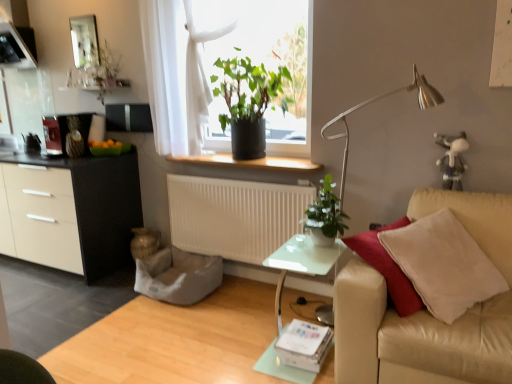
Question: In which direction should I rotate to look at green matte plant at upper center, the 1th houseplant positioned from the back?

Choices:
 (A) right
 (B) left

Answer: (B)

Question: Is green leafy plant at center wider than silver metallic floor lamp at right?

Choices:
 (A) no
 (B) yes

Answer: (A)

Question: Considering the relative sizes of green leafy plant at center and silver metallic floor lamp at right in the image provided, is green leafy plant at center bigger than silver metallic floor lamp at right?

Choices:
 (A) no
 (B) yes

Answer: (B)

Question: From a real-world perspective, is green leafy plant at center over silver metallic floor lamp at right?

Choices:
 (A) yes
 (B) no

Answer: (A)

Question: Could silver metallic floor lamp at right be considered to be inside green leafy plant at center?

Choices:
 (A) yes
 (B) no

Answer: (B)

Question: Considering the relative positions of green leafy plant at center and silver metallic floor lamp at right in the image provided, is green leafy plant at center behind silver metallic floor lamp at right?

Choices:
 (A) yes
 (B) no

Answer: (A)

Question: Considering the relative sizes of green leafy plant at center and silver metallic floor lamp at right in the image provided, is green leafy plant at center thinner than silver metallic floor lamp at right?

Choices:
 (A) no
 (B) yes

Answer: (B)

Question: Are smooth beige couch at right and transparent glass door at left located far from each other?

Choices:
 (A) no
 (B) yes

Answer: (B)

Question: Considering the relative sizes of smooth beige couch at right and transparent glass door at left in the image provided, is smooth beige couch at right smaller than transparent glass door at left?

Choices:
 (A) yes
 (B) no

Answer: (B)

Question: From a real-world perspective, is smooth beige couch at right positioned under transparent glass door at left based on gravity?

Choices:
 (A) yes
 (B) no

Answer: (A)

Question: Is smooth beige couch at right positioned before transparent glass door at left?

Choices:
 (A) no
 (B) yes

Answer: (B)

Question: Considering the relative sizes of smooth beige couch at right and transparent glass door at left in the image provided, is smooth beige couch at right thinner than transparent glass door at left?

Choices:
 (A) yes
 (B) no

Answer: (B)

Question: From a real-world perspective, is smooth beige couch at right located higher than transparent glass door at left?

Choices:
 (A) no
 (B) yes

Answer: (A)

Question: Is white matte radiator at center shorter than green matte plant at upper center, the second houseplant from the bottom?

Choices:
 (A) no
 (B) yes

Answer: (B)